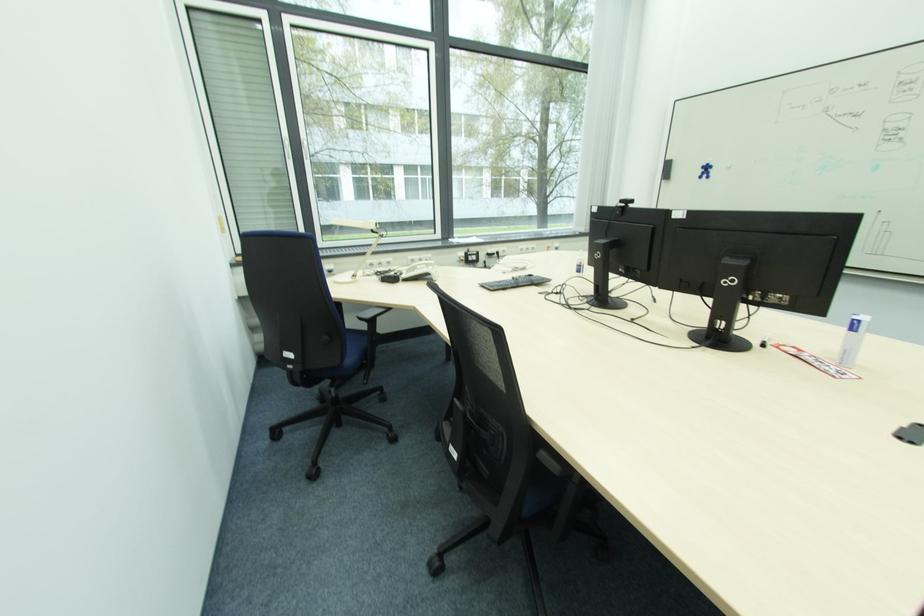
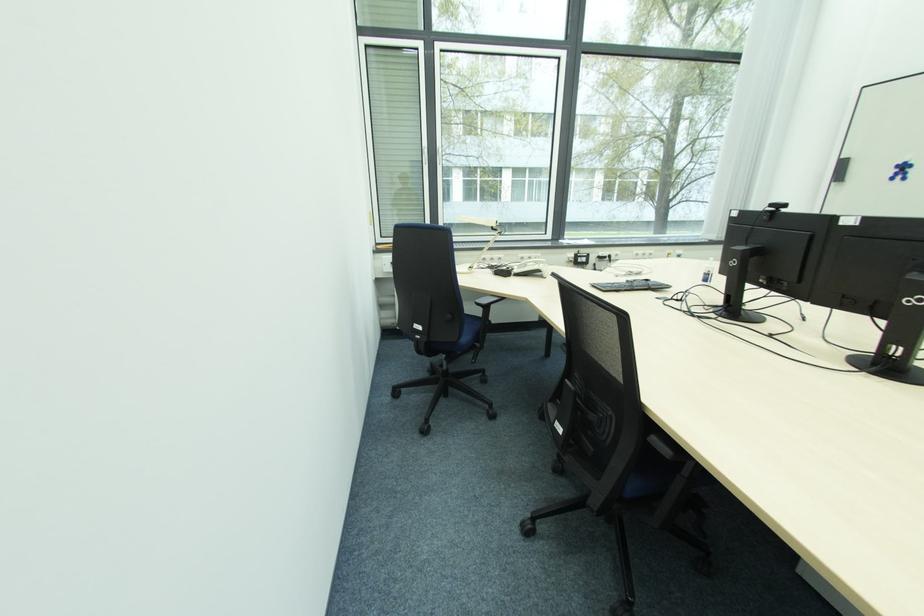
Question: How did the camera likely rotate?

Choices:
 (A) Left
 (B) Right
 (C) Up
 (D) Down

Answer: (A)